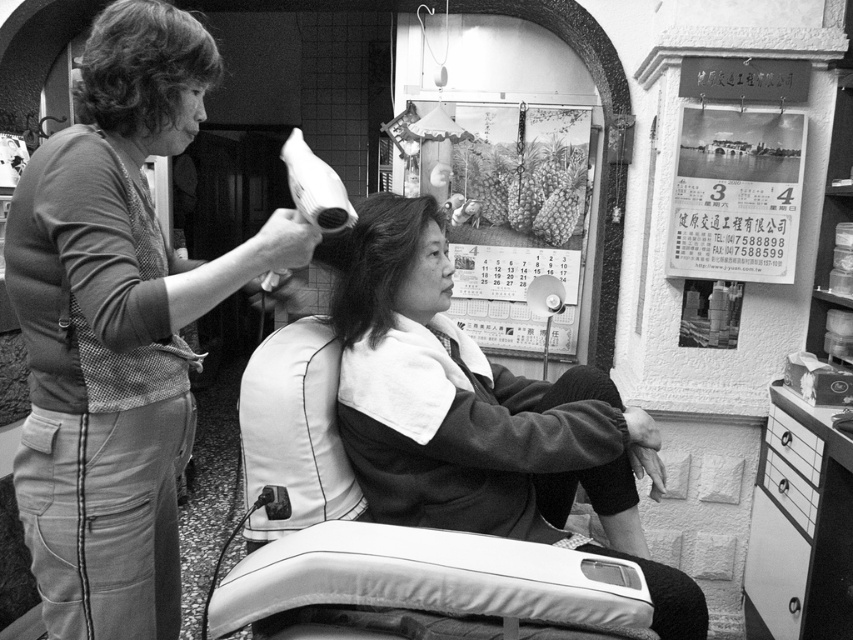
Where is `smooth black hair at center`? smooth black hair at center is located at coordinates (479, 413).

Find the location of `smooth black hair at center`. smooth black hair at center is located at coordinates (x=479, y=413).

Is matte gray hairdryer at upper left to the right of smooth black hair at center from the viewer's perspective?

Incorrect, matte gray hairdryer at upper left is not on the right side of smooth black hair at center.

Does point (117, 410) lie behind point (647, 432)?

No, it is in front of (647, 432).

Find the location of `matte gray hairdryer at upper left`. matte gray hairdryer at upper left is located at coordinates 117,326.

Can you confirm if matte gray hairdryer at upper left is bigger than smooth hair at center?

Correct, matte gray hairdryer at upper left is larger in size than smooth hair at center.

Which is more to the right, matte gray hairdryer at upper left or smooth hair at center?

smooth hair at center is more to the right.

Is point (24, 477) more distant than point (374, 282)?

That is False.

Where is `matte gray hairdryer at upper left`? matte gray hairdryer at upper left is located at coordinates (117, 326).